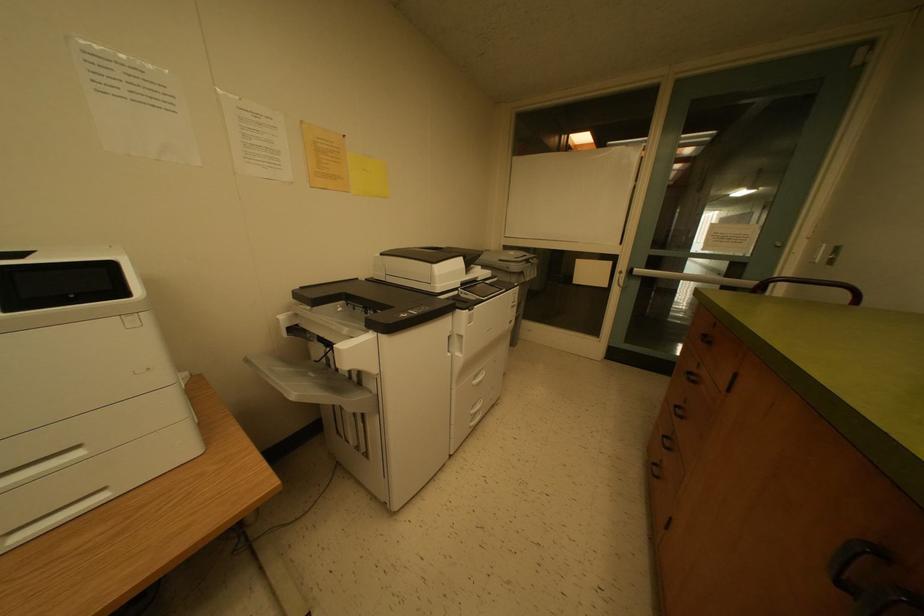
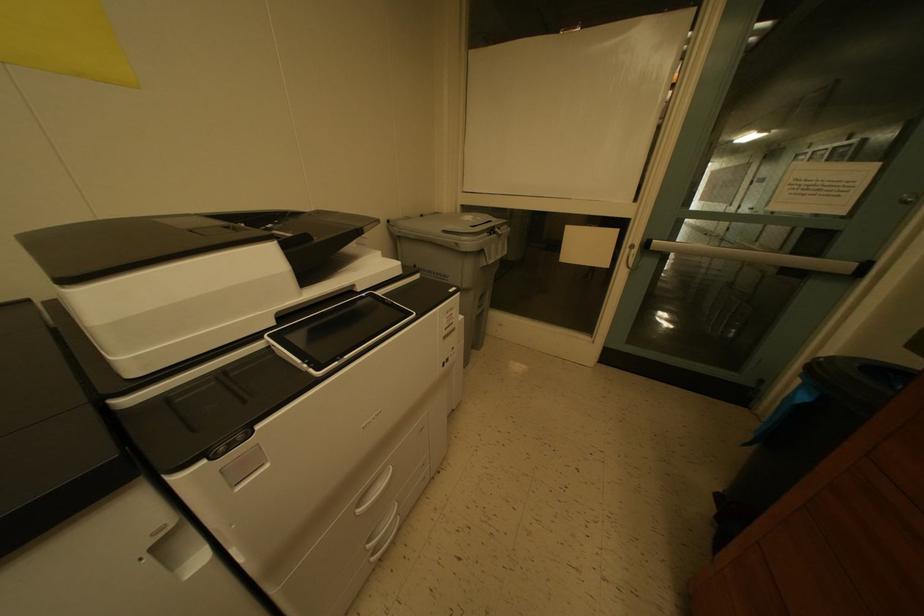
Question: How did the camera likely rotate?

Choices:
 (A) Left
 (B) Right
 (C) Up
 (D) Down

Answer: (D)